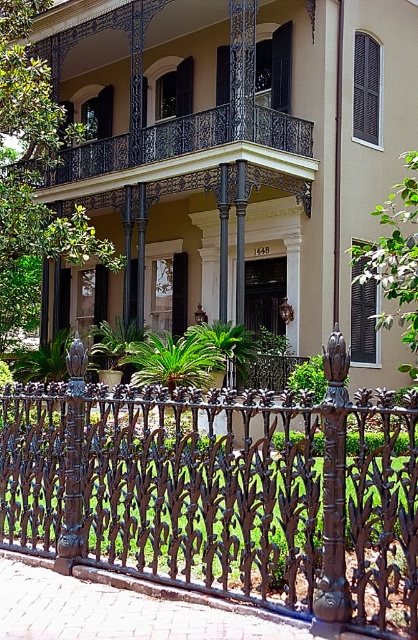
You are a delivery person trying to determine the best path to the front door of the building. You notice the black wrought iron balcony at upper center and the polished bronze post at center. Which object is taller, and how might this affect your delivery route?

The black wrought iron balcony at upper center is taller than the polished bronze post at center. Since the balcony is higher, it might indicate that the front door is located below it, so you should head towards the center of the building where the balcony is positioned to reach the entrance.